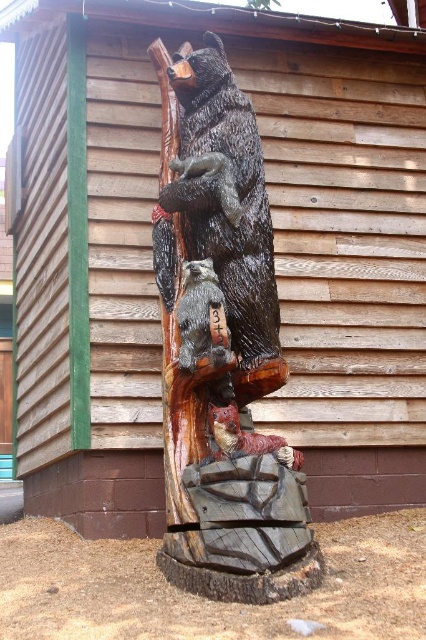
Is carved wood bear at center positioned behind carved wood raccoon at center?

No, carved wood bear at center is closer to the viewer.

Describe the element at coordinates (221, 340) in the screenshot. This screenshot has height=640, width=426. I see `carved wood bear at center` at that location.

Which is in front, point (215, 579) or point (187, 285)?

Point (215, 579)

Where is `carved wood bear at center`? The width and height of the screenshot is (426, 640). carved wood bear at center is located at coordinates (221, 340).